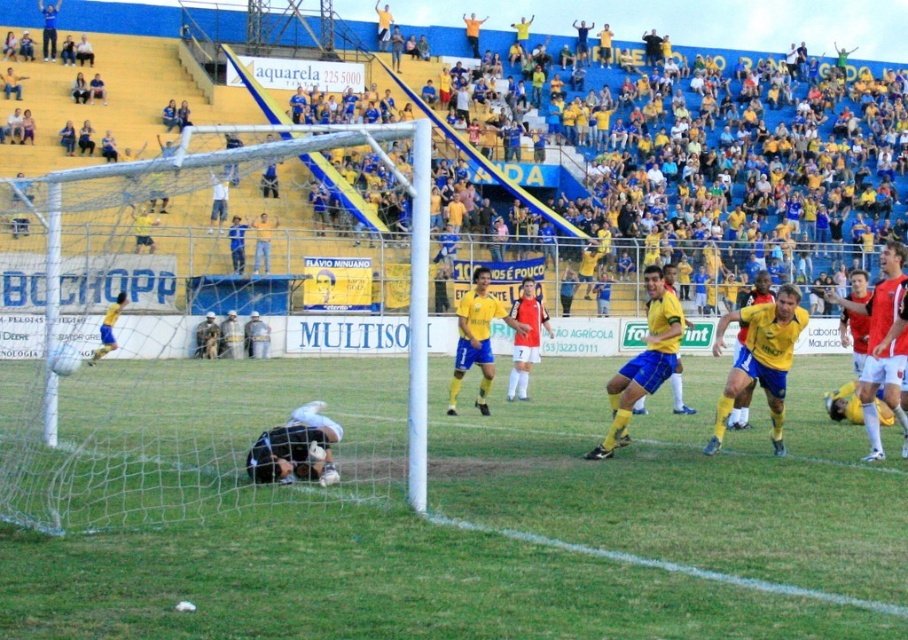
You are a soccer coach analyzing the play. You notice the yellow jersey at center and the green grass at center. Which object is covering the other?

The yellow jersey at center is positioned over green grass at center, so the yellow jersey is covering the green grass.